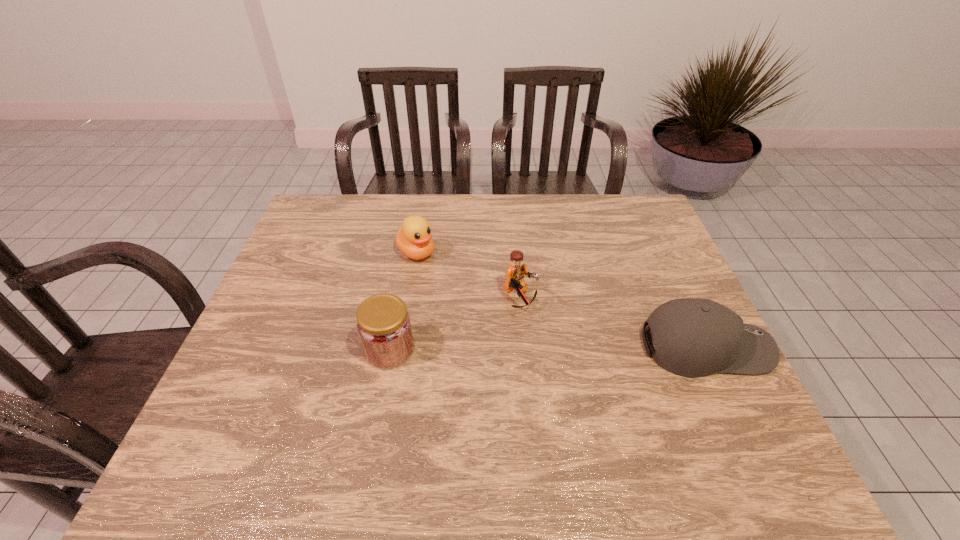
Locate an element on the screen. vacant space on the desktop that is between the jam and the rightmost object and is positioned on the face of the duckling is located at coordinates (527, 348).

Where is `free space on the desktop that is between the jam and the baseball cap and is positioned holding a crossbow in the hands of the second object from right to left`? free space on the desktop that is between the jam and the baseball cap and is positioned holding a crossbow in the hands of the second object from right to left is located at coordinates (581, 348).